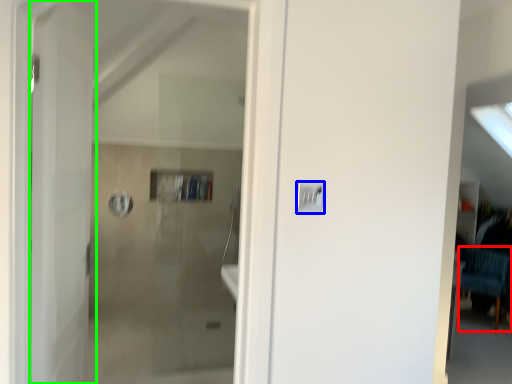
Question: Considering the real-world distances, which object is farthest from furniture (highlighted by a red box)? light switch (highlighted by a blue box) or door (highlighted by a green box)?

Choices:
 (A) light switch
 (B) door

Answer: (B)